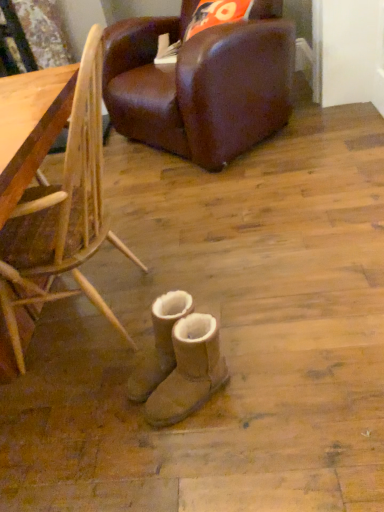
Identify the location of brown leather chair at upper center, the first chair when ordered from back to front. pyautogui.click(x=201, y=83).

In order to click on tan suede boots at center, the 2th footwear positioned from the front in this screenshot , I will do `click(159, 345)`.

Is bamboo chair at lower right, which is the first chair in bottom-to-top order, positioned far away from tan suede boots at center, which appears as the first footwear when viewed from the back?

No, bamboo chair at lower right, which is the first chair in bottom-to-top order, is not far away from tan suede boots at center, which appears as the first footwear when viewed from the back.

Considering the sizes of bamboo chair at lower right, positioned as the 2th chair in top-to-bottom order, and tan suede boots at center, the 2th footwear positioned from the front, in the image, is bamboo chair at lower right, positioned as the 2th chair in top-to-bottom order, bigger or smaller than tan suede boots at center, the 2th footwear positioned from the front,?

Clearly, bamboo chair at lower right, positioned as the 2th chair in top-to-bottom order, is larger in size than tan suede boots at center, the 2th footwear positioned from the front.

From the bamboo chair at lower right, which is the first chair in bottom-to-top order, count 2nd footwears backward and point to it. Please provide its 2D coordinates.

[(159, 345)]

From the image's perspective, is bamboo chair at lower right, marked as the second chair in a back-to-front arrangement, over tan suede boots at center, which appears as the first footwear when viewed from the back?

Yes, from the image's perspective, bamboo chair at lower right, marked as the second chair in a back-to-front arrangement, is on top of tan suede boots at center, which appears as the first footwear when viewed from the back.

Is tan suede boots at center, which appears as the first footwear when viewed from the back, facing towards brown leather chair at upper center, the first chair when ordered from back to front?

No, tan suede boots at center, which appears as the first footwear when viewed from the back, is not turned towards brown leather chair at upper center, the first chair when ordered from back to front.

Considering the sizes of objects tan suede boots at center, the 2th footwear positioned from the front, and brown leather chair at upper center, the 2th chair when ordered from front to back, in the image provided, who is taller, tan suede boots at center, the 2th footwear positioned from the front, or brown leather chair at upper center, the 2th chair when ordered from front to back,?

Standing taller between the two is brown leather chair at upper center, the 2th chair when ordered from front to back.

From the picture: From the image's perspective, which one is positioned lower, tan suede boots at center, which appears as the first footwear when viewed from the back, or brown leather chair at upper center, the first chair when ordered from back to front?

tan suede boots at center, which appears as the first footwear when viewed from the back.

Can you tell me how much tan suede boots at center, the 2th footwear positioned from the front, and brown leather chair at upper center, the 2th chair positioned from the bottom, differ in facing direction?

There is a 7.96-degree angle between the facing directions of tan suede boots at center, the 2th footwear positioned from the front, and brown leather chair at upper center, the 2th chair positioned from the bottom.

Is tan suede boots at center, positioned as the first footwear in front-to-back order, positioned far away from tan suede boots at center, which appears as the first footwear when viewed from the back?

No, there isn't a large distance between tan suede boots at center, positioned as the first footwear in front-to-back order, and tan suede boots at center, which appears as the first footwear when viewed from the back.

Between tan suede boots at center, positioned as the first footwear in front-to-back order, and tan suede boots at center, the 2th footwear positioned from the front, which one has larger width?

tan suede boots at center, the 2th footwear positioned from the front, is wider.

How many degrees apart are the facing directions of tan suede boots at center, the second footwear in the back-to-front sequence, and tan suede boots at center, which appears as the first footwear when viewed from the back?

The angle between the facing direction of tan suede boots at center, the second footwear in the back-to-front sequence, and the facing direction of tan suede boots at center, which appears as the first footwear when viewed from the back, is 0.592 degrees.

Is point (158, 421) closer or farther from the camera than point (160, 302)?

Point (158, 421) is positioned closer to the camera compared to point (160, 302).

From a real-world perspective, between brown leather chair at upper center, the first chair when ordered from back to front, and bamboo chair at lower right, positioned as the 2th chair in top-to-bottom order, who is vertically higher?

In real-world perspective, bamboo chair at lower right, positioned as the 2th chair in top-to-bottom order, is above.

Is brown leather chair at upper center, arranged as the first chair when viewed from the top, facing towards bamboo chair at lower right, marked as the second chair in a back-to-front arrangement?

Yes, brown leather chair at upper center, arranged as the first chair when viewed from the top, is aimed at bamboo chair at lower right, marked as the second chair in a back-to-front arrangement.

Considering the positions of objects brown leather chair at upper center, the 2th chair positioned from the bottom, and bamboo chair at lower right, which is the 1th chair in front-to-back order, in the image provided, who is more to the left, brown leather chair at upper center, the 2th chair positioned from the bottom, or bamboo chair at lower right, which is the 1th chair in front-to-back order,?

Positioned to the left is bamboo chair at lower right, which is the 1th chair in front-to-back order.

Is tan suede boots at center, the 2th footwear positioned from the front, not within bamboo chair at lower right, which is the 1th chair in front-to-back order?

Yes, tan suede boots at center, the 2th footwear positioned from the front, is located beyond the bounds of bamboo chair at lower right, which is the 1th chair in front-to-back order.

Is the position of tan suede boots at center, which appears as the first footwear when viewed from the back, more distant than that of bamboo chair at lower right, which is the 1th chair in front-to-back order?

Yes, tan suede boots at center, which appears as the first footwear when viewed from the back, is further from the viewer.

Starting from the bamboo chair at lower right, which is the 1th chair in front-to-back order, which footwear is the 2nd one behind? Please provide its 2D coordinates.

[(159, 345)]

Based on the photo, can you confirm if tan suede boots at center, the 2th footwear positioned from the front, is bigger than bamboo chair at lower right, which is the 1th chair in front-to-back order?

Incorrect, tan suede boots at center, the 2th footwear positioned from the front, is not larger than bamboo chair at lower right, which is the 1th chair in front-to-back order.

From their relative heights in the image, would you say brown leather chair at upper center, the first chair when ordered from back to front, is taller or shorter than tan suede boots at center, which appears as the first footwear when viewed from the back?

Considering their sizes, brown leather chair at upper center, the first chair when ordered from back to front, has more height than tan suede boots at center, which appears as the first footwear when viewed from the back.

Would you say tan suede boots at center, the 2th footwear positioned from the front, is part of brown leather chair at upper center, the 2th chair when ordered from front to back,'s contents?

Definitely not — tan suede boots at center, the 2th footwear positioned from the front, is not inside brown leather chair at upper center, the 2th chair when ordered from front to back.

Is brown leather chair at upper center, arranged as the first chair when viewed from the top, behind tan suede boots at center, which appears as the first footwear when viewed from the back?

Yes, the depth of brown leather chair at upper center, arranged as the first chair when viewed from the top, is greater than that of tan suede boots at center, which appears as the first footwear when viewed from the back.

From the image's perspective, does tan suede boots at center, the second footwear in the back-to-front sequence, appear higher than brown leather chair at upper center, arranged as the first chair when viewed from the top?

No.

Which of these two, tan suede boots at center, positioned as the first footwear in front-to-back order, or brown leather chair at upper center, the 2th chair positioned from the bottom, is bigger?

Bigger between the two is brown leather chair at upper center, the 2th chair positioned from the bottom.

Between point (206, 362) and point (122, 48), which one is positioned in front?

Point (206, 362)

From a real-world perspective, is tan suede boots at center, the second footwear in the back-to-front sequence, on brown leather chair at upper center, the 2th chair when ordered from front to back?

Incorrect, from a real-world perspective, tan suede boots at center, the second footwear in the back-to-front sequence, is lower than brown leather chair at upper center, the 2th chair when ordered from front to back.

From the image's perspective, which footwear is the 1st one below the bamboo chair at lower right, which is the 1th chair in front-to-back order? Please provide its 2D coordinates.

[(159, 345)]

There is a tan suede boots at center, the 2th footwear positioned from the front. At what (x,y) coordinates should I click in order to perform the action: click on the 2nd chair above it (from the image's perspective). Please return your answer as a coordinate pair (x, y). This screenshot has height=512, width=384. Looking at the image, I should click on (201, 83).

Looking at the image, which one is located further to tan suede boots at center, which appears as the first footwear when viewed from the back, tan suede boots at center, the second footwear in the back-to-front sequence, or brown leather chair at upper center, arranged as the first chair when viewed from the top?

brown leather chair at upper center, arranged as the first chair when viewed from the top.

Which object lies nearer to the anchor point tan suede boots at center, which appears as the first footwear when viewed from the back, brown leather chair at upper center, the 2th chair when ordered from front to back, or bamboo chair at lower right, marked as the second chair in a back-to-front arrangement?

bamboo chair at lower right, marked as the second chair in a back-to-front arrangement, is positioned closer to the anchor tan suede boots at center, which appears as the first footwear when viewed from the back.

Based on their spatial positions, is tan suede boots at center, positioned as the first footwear in front-to-back order, or bamboo chair at lower right, which is the 1th chair in front-to-back order, further from tan suede boots at center, the 2th footwear positioned from the front?

The object further to tan suede boots at center, the 2th footwear positioned from the front, is bamboo chair at lower right, which is the 1th chair in front-to-back order.

Which object lies nearer to the anchor point tan suede boots at center, positioned as the first footwear in front-to-back order, bamboo chair at lower right, positioned as the 2th chair in top-to-bottom order, or brown leather chair at upper center, the 2th chair when ordered from front to back?

bamboo chair at lower right, positioned as the 2th chair in top-to-bottom order, is closer to tan suede boots at center, positioned as the first footwear in front-to-back order.

Looking at the image, which one is located closer to brown leather chair at upper center, the 2th chair positioned from the bottom, bamboo chair at lower right, positioned as the 2th chair in top-to-bottom order, or tan suede boots at center, which appears as the first footwear when viewed from the back?

Among the two, bamboo chair at lower right, positioned as the 2th chair in top-to-bottom order, is located nearer to brown leather chair at upper center, the 2th chair positioned from the bottom.

Looking at the image, which one is located further to tan suede boots at center, the second footwear in the back-to-front sequence, brown leather chair at upper center, the first chair when ordered from back to front, or tan suede boots at center, which appears as the first footwear when viewed from the back?

brown leather chair at upper center, the first chair when ordered from back to front, is positioned further to the anchor tan suede boots at center, the second footwear in the back-to-front sequence.

Based on their spatial positions, is tan suede boots at center, which appears as the first footwear when viewed from the back, or tan suede boots at center, the second footwear in the back-to-front sequence, further from bamboo chair at lower right, which is the 1th chair in front-to-back order?

tan suede boots at center, the second footwear in the back-to-front sequence, is positioned further to the anchor bamboo chair at lower right, which is the 1th chair in front-to-back order.

In the scene shown: From the image, which object appears to be farther from brown leather chair at upper center, the 2th chair positioned from the bottom, tan suede boots at center, positioned as the first footwear in front-to-back order, or bamboo chair at lower right, marked as the second chair in a back-to-front arrangement?

The object further to brown leather chair at upper center, the 2th chair positioned from the bottom, is tan suede boots at center, positioned as the first footwear in front-to-back order.

Locate an element on the screen. The width and height of the screenshot is (384, 512). footwear between brown leather chair at upper center, arranged as the first chair when viewed from the top, and tan suede boots at center, positioned as the first footwear in front-to-back order, from top to bottom is located at coordinates (159, 345).

I want to click on chair between brown leather chair at upper center, arranged as the first chair when viewed from the top, and tan suede boots at center, positioned as the first footwear in front-to-back order, in the vertical direction, so click(x=71, y=203).

Image resolution: width=384 pixels, height=512 pixels. In order to click on chair between brown leather chair at upper center, the 2th chair positioned from the bottom, and tan suede boots at center, which appears as the first footwear when viewed from the back, vertically in this screenshot , I will do `click(71, 203)`.

Find the location of a particular element. The width and height of the screenshot is (384, 512). footwear between bamboo chair at lower right, which is the first chair in bottom-to-top order, and tan suede boots at center, positioned as the first footwear in front-to-back order, in the up-down direction is located at coordinates (159, 345).